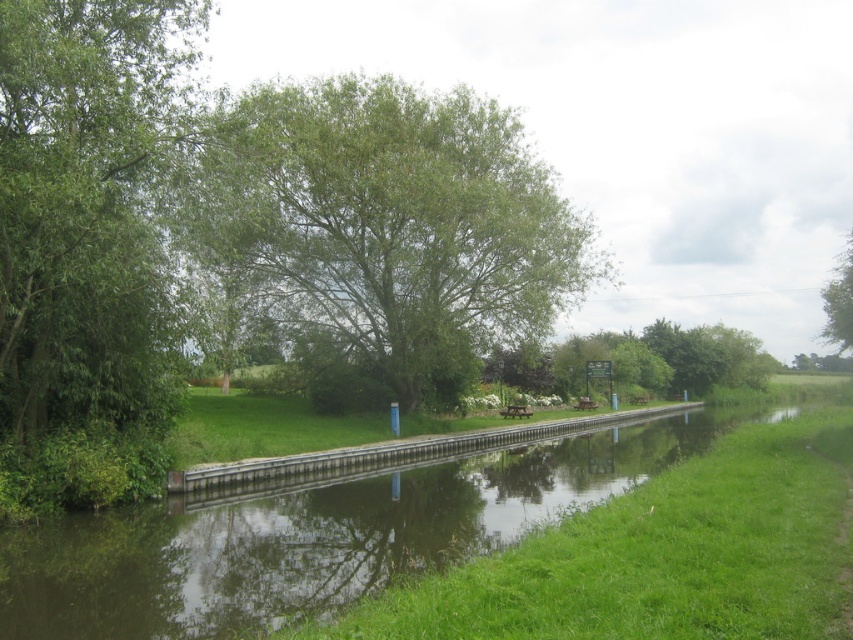
What do you see at coordinates (86, 209) in the screenshot?
I see `green leafy tree at left` at bounding box center [86, 209].

Between point (154, 3) and point (637, 522), which one is positioned in front?

Point (637, 522) is more forward.

What are the coordinates of `green leafy tree at left` in the screenshot? It's located at (86, 209).

Who is shorter, green leafy tree at center or green leafy tree at left?

Standing shorter between the two is green leafy tree at left.

Can you confirm if green leafy tree at center is thinner than green leafy tree at left?

No.

I want to click on green leafy tree at center, so click(x=389, y=224).

Is point (230, 218) closer to viewer compared to point (689, 547)?

That is False.

Is point (456, 140) more distant than point (558, 634)?

Yes.

I want to click on green leafy tree at center, so click(x=389, y=224).